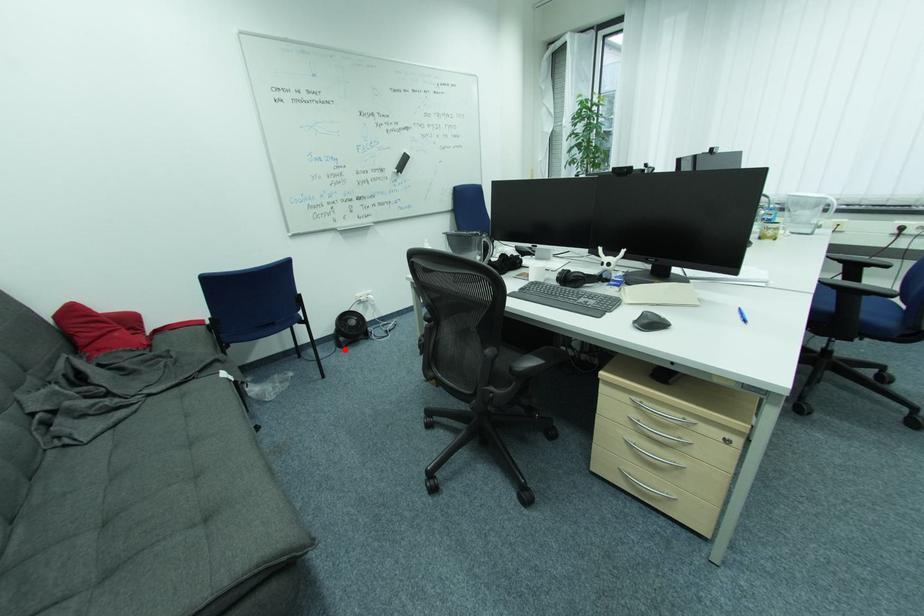
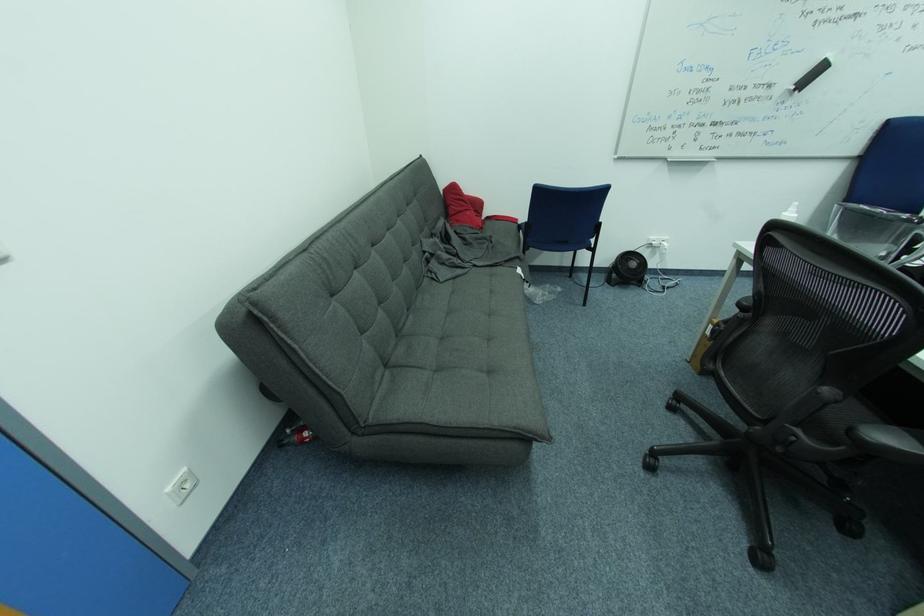
In the second image, find the point that corresponds to the highlighted location in the first image.

(613, 285)